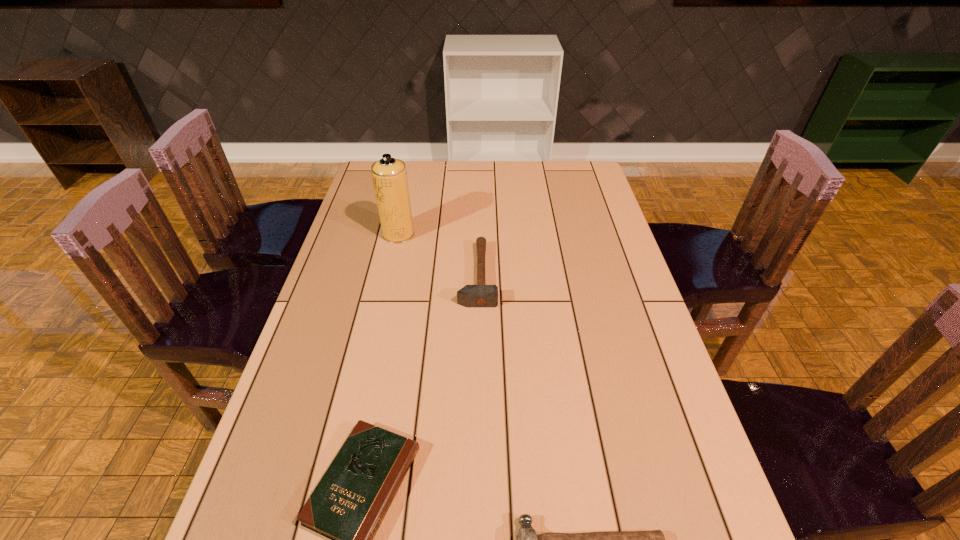
Where is `blank region between the aerosol can and the taller hammer`? The height and width of the screenshot is (540, 960). blank region between the aerosol can and the taller hammer is located at coordinates (438, 255).

At what (x,y) coordinates should I click in order to perform the action: click on vacant area that lies between the aerosol can and the second farthest object. Please return your answer as a coordinate pair (x, y). The width and height of the screenshot is (960, 540). Looking at the image, I should click on [x=438, y=255].

The height and width of the screenshot is (540, 960). Find the location of `vacant area between the third object from left to right and the aerosol can`. vacant area between the third object from left to right and the aerosol can is located at coordinates (438, 255).

Find the location of a particular element. the closest object to the farthest object is located at coordinates (481, 295).

Select which object is the second closest to the Bible. Please provide its 2D coordinates. Your answer should be formatted as a tuple, i.e. [(x, y)], where the tuple contains the x and y coordinates of a point satisfying the conditions above.

[(481, 295)]